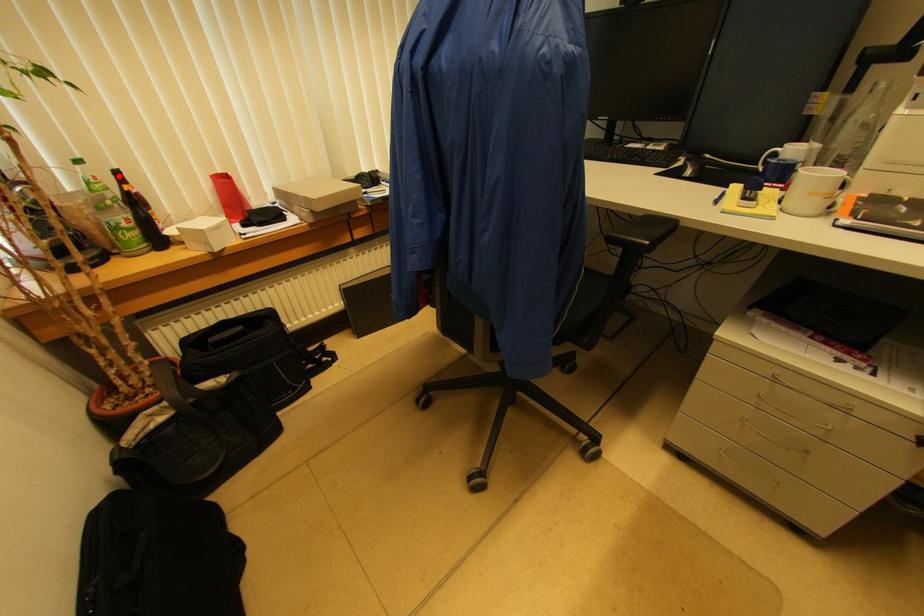
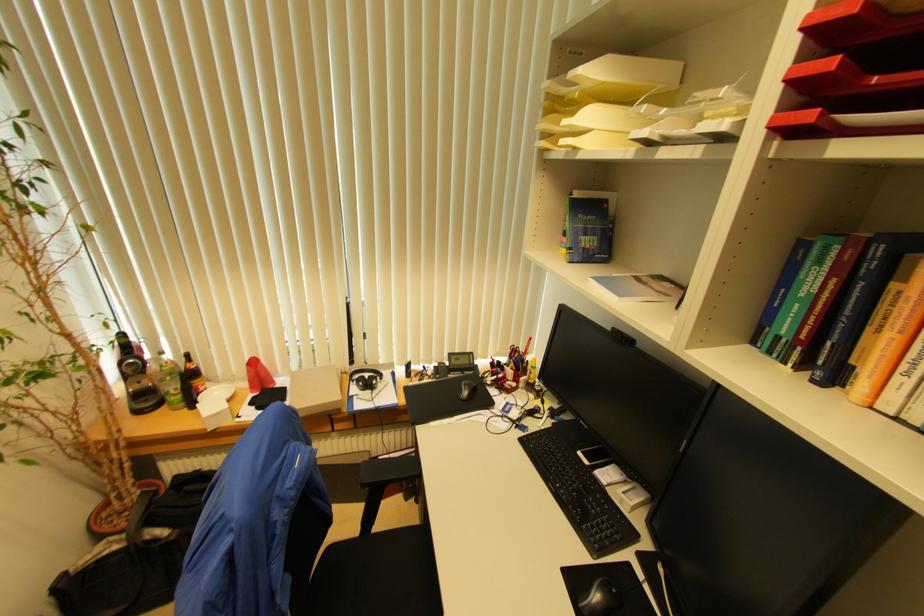
Question: I am providing you with two images of the same scene from different viewpoints. Image1 has a red point marked. In image2, the corresponding 3D location appears at what relative position? Reply with the corresponding letter.

Choices:
 (A) Closer
 (B) Farther

Answer: (A)